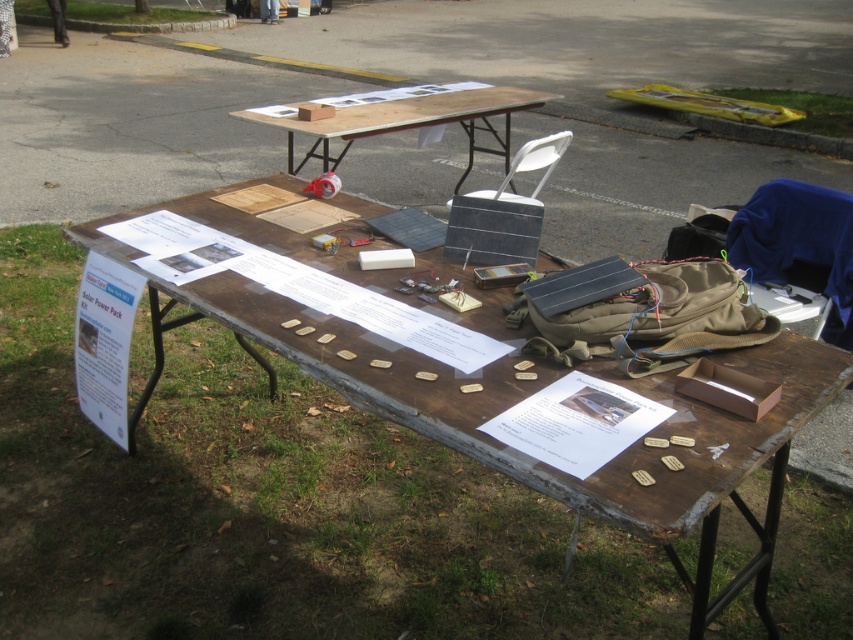
Is point (793, 349) positioned after point (457, 106)?

No, (793, 349) is closer to viewer.

This screenshot has height=640, width=853. What do you see at coordinates (531, 394) in the screenshot?
I see `brown wooden table at center` at bounding box center [531, 394].

Find the location of `brown wooden table at center`. brown wooden table at center is located at coordinates (531, 394).